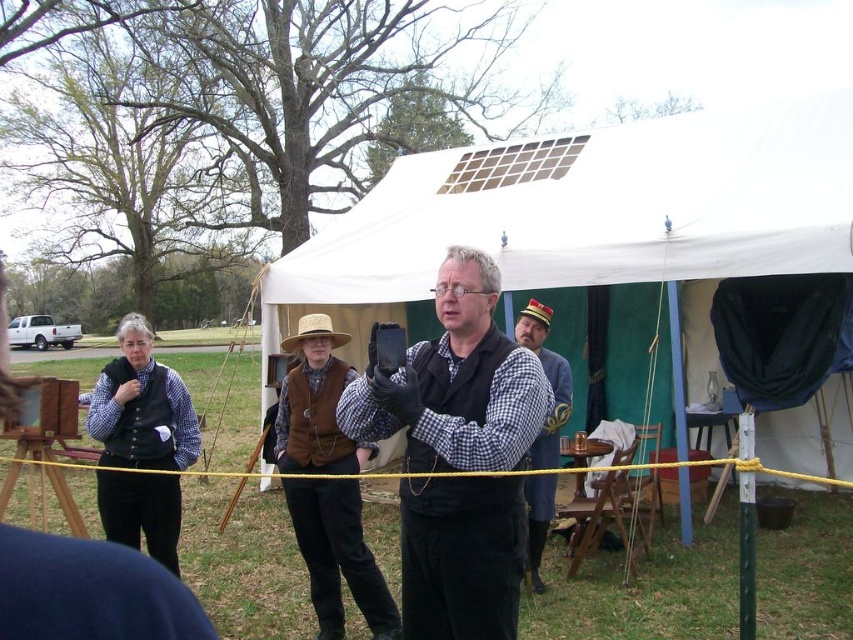
How much distance is there between white canvas tent at center and brown straw cowboy hat at center?

white canvas tent at center and brown straw cowboy hat at center are 4.88 meters apart from each other.

Who is higher up, white canvas tent at center or brown straw cowboy hat at center?

brown straw cowboy hat at center is above.

Is point (838, 442) more distant than point (280, 340)?

No.

Image resolution: width=853 pixels, height=640 pixels. Identify the location of white canvas tent at center. (628, 260).

Can you confirm if matte black vest at center is taller than brown straw cowboy hat at center?

Yes.

Can you confirm if matte black vest at center is positioned below brown straw cowboy hat at center?

Yes, matte black vest at center is below brown straw cowboy hat at center.

Locate an element on the screen. This screenshot has height=640, width=853. matte black vest at center is located at coordinates (454, 381).

Between matte black vest at left and brown leather hat at center, which one has less height?

With less height is matte black vest at left.

Does matte black vest at left appear on the left side of brown leather hat at center?

Yes, matte black vest at left is to the left of brown leather hat at center.

Is point (193, 461) in front of point (556, 422)?

Yes, it is.

I want to click on matte black vest at left, so click(x=141, y=406).